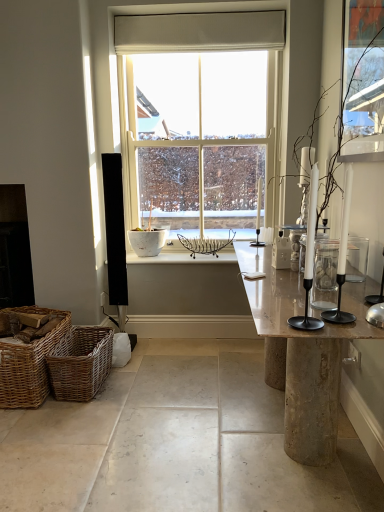
Where is `free space to the left of clear glass jar at right`? Image resolution: width=384 pixels, height=512 pixels. free space to the left of clear glass jar at right is located at coordinates (285, 292).